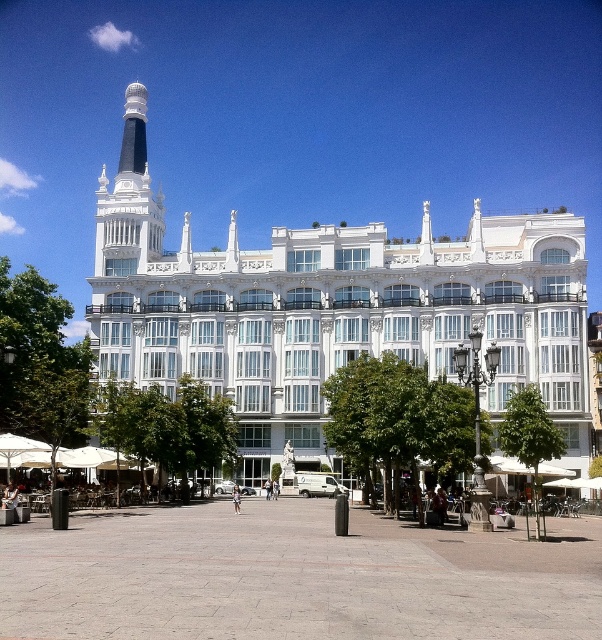
You are an architect evaluating the building design. Based on the image, which object is taller between the white glossy building at center and the white marble tower at upper center?

The white glossy building at center is much taller than the white marble tower at upper center according to the description.

You are an architect visiting the plaza in front of the building. You notice the white glossy building at center and the white marble tower at upper center. Which one is closer to you from your current position on the plaza?

The white glossy building at center is closer to you because it is positioned in front of the white marble tower at upper center.

You are standing in the plaza in front of the white glossy building at center and the white marble tower at upper center. Which one is located to the left of the other?

The white marble tower at upper center is located to the left of the white glossy building at center.